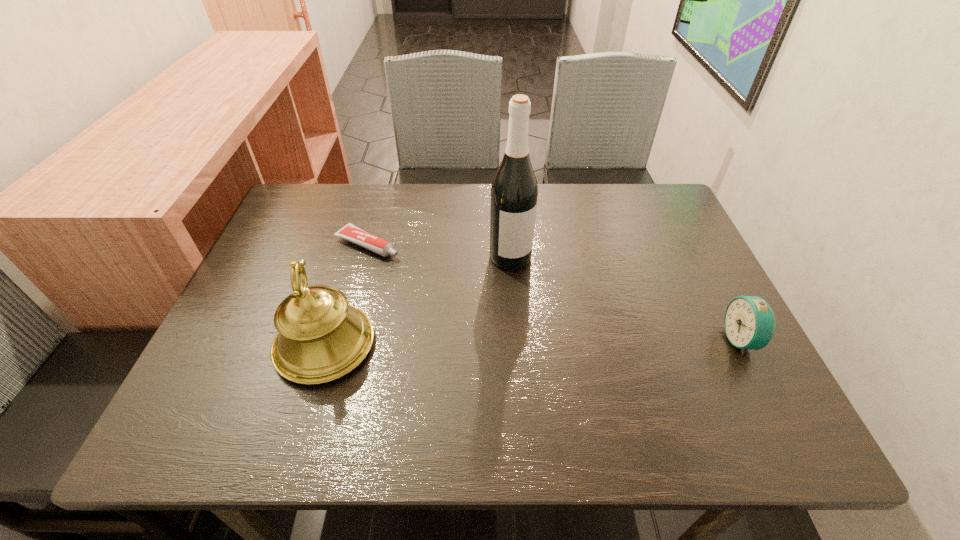
Find the location of a particular element. The width and height of the screenshot is (960, 540). unoccupied area between the rightmost object and the second tallest object is located at coordinates (533, 342).

Find the location of a particular element. Image resolution: width=960 pixels, height=540 pixels. empty space that is in between the toothpaste and the third tallest object is located at coordinates (555, 292).

Find the location of `free point between the second tallest object and the second object from right to left`. free point between the second tallest object and the second object from right to left is located at coordinates (418, 301).

Locate an element on the screen. This screenshot has width=960, height=540. free space between the bell and the rightmost object is located at coordinates (533, 342).

The image size is (960, 540). I want to click on blank region between the tallest object and the shortest object, so click(439, 251).

Find the location of a particular element. This screenshot has height=540, width=960. free space between the alarm clock and the second object from right to left is located at coordinates (626, 298).

At what (x,y) coordinates should I click in order to perform the action: click on free space between the toothpaste and the rightmost object. Please return your answer as a coordinate pair (x, y). The width and height of the screenshot is (960, 540). Looking at the image, I should click on (555, 292).

Image resolution: width=960 pixels, height=540 pixels. I want to click on free space between the toothpaste and the third shortest object, so click(347, 294).

Locate an element on the screen. empty space that is in between the toothpaste and the wine bottle is located at coordinates (439, 251).

Locate an element on the screen. Image resolution: width=960 pixels, height=540 pixels. vacant area between the toothpaste and the alarm clock is located at coordinates (555, 292).